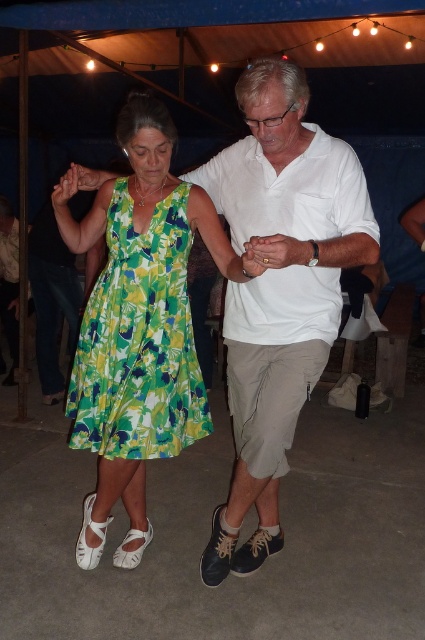
Between point (261, 403) and point (164, 250), which one is positioned behind?

The point (164, 250) is behind.

Is point (266, 504) farther from viewer compared to point (183, 374)?

Yes, point (266, 504) is behind point (183, 374).

You are a GUI agent. You are given a task and a screenshot of the screen. Output one action in this format:
    pyautogui.click(x=<x>, y=<y>)
    Task: Click on the white cotton shirt at center
    This screenshot has height=640, width=425.
    Given the screenshot: What is the action you would take?
    pyautogui.click(x=278, y=289)

Does green floral dress at left have a larger size compared to green floral fabric dress at left?

Yes, green floral dress at left is bigger than green floral fabric dress at left.

Who is more forward, (139, 470) or (201, 429)?

Positioned in front is point (201, 429).

Measure the distance between point [144,220] and camera.

Point [144,220] and camera are 6.33 feet apart from each other.

Locate an element on the screen. Image resolution: width=425 pixels, height=640 pixels. green floral dress at left is located at coordinates (138, 324).

Can you confirm if white cotton shirt at center is positioned above green floral dress at left?

Yes.

Which is above, white cotton shirt at center or green floral dress at left?

Positioned higher is white cotton shirt at center.

Who is more forward, (342, 204) or (124, 301)?

Positioned in front is point (342, 204).

Find the location of a particular element. Image resolution: width=425 pixels, height=640 pixels. white cotton shirt at center is located at coordinates pyautogui.click(x=278, y=289).